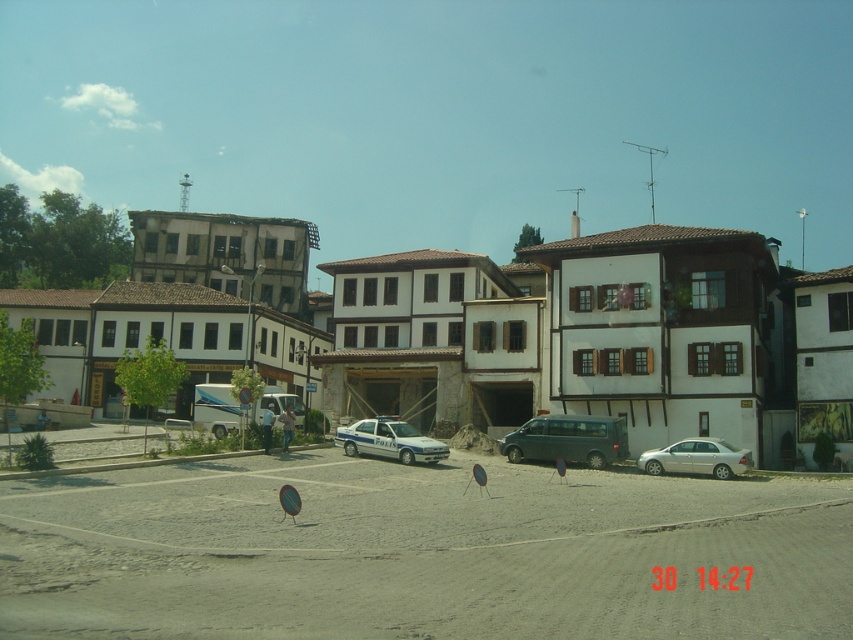
Can you confirm if smooth asphalt parking lot at center is wider than white painted building at center?

No, smooth asphalt parking lot at center is not wider than white painted building at center.

Is smooth asphalt parking lot at center thinner than white painted building at center?

Yes.

Between point (763, 520) and point (442, 252), which one is positioned behind?

Positioned behind is point (442, 252).

Locate an element on the screen. The height and width of the screenshot is (640, 853). smooth asphalt parking lot at center is located at coordinates (419, 552).

Who is lower down, white painted building at center or silver metallic sedan at lower right?

Positioned lower is silver metallic sedan at lower right.

Is point (683, 237) positioned in front of point (682, 460)?

No, it is not.

Measure the distance between point (344,378) and camera.

Point (344,378) is 192.43 feet away from camera.

Locate an element on the screen. white painted building at center is located at coordinates (602, 337).

Can you confirm if smooth asphalt parking lot at center is smaller than silver metallic sedan at lower right?

Incorrect, smooth asphalt parking lot at center is not smaller in size than silver metallic sedan at lower right.

Describe the element at coordinates (419, 552) in the screenshot. The width and height of the screenshot is (853, 640). I see `smooth asphalt parking lot at center` at that location.

What do you see at coordinates (419, 552) in the screenshot? This screenshot has height=640, width=853. I see `smooth asphalt parking lot at center` at bounding box center [419, 552].

Image resolution: width=853 pixels, height=640 pixels. What are the coordinates of `smooth asphalt parking lot at center` in the screenshot? It's located at (419, 552).